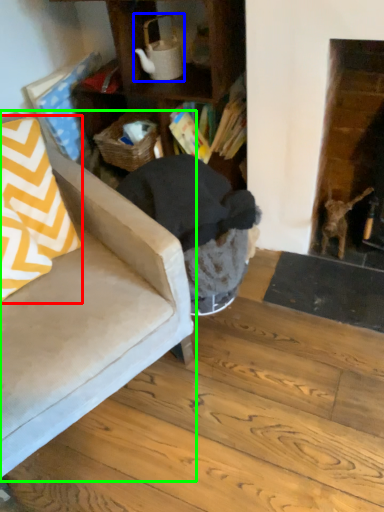
Question: Based on their relative distances, which object is nearer to throw pillow (highlighted by a red box)? Choose from tea pot (highlighted by a blue box) and chair (highlighted by a green box).

Choices:
 (A) tea pot
 (B) chair

Answer: (B)